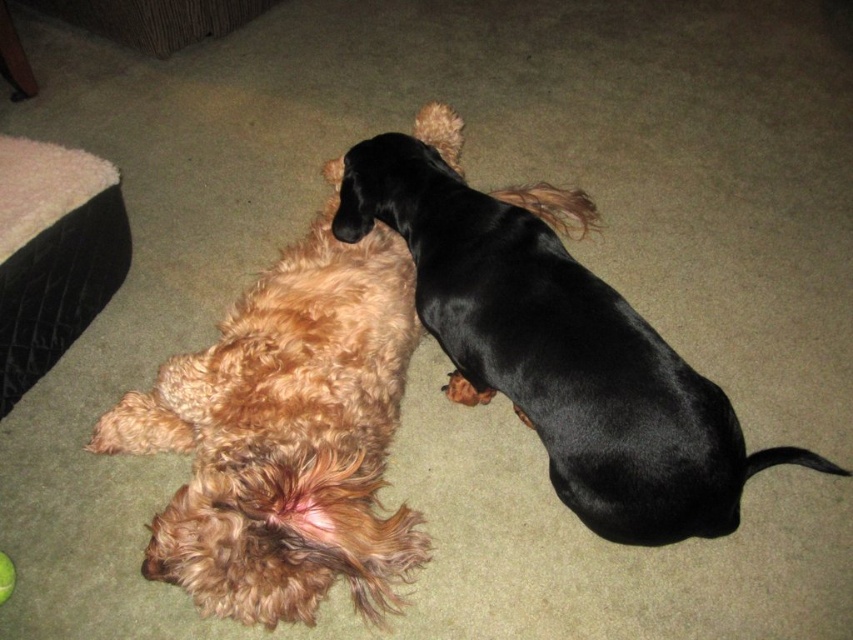
You are a dog owner who wants to place a rectangular dog bed in the middle of the room. The bed is exactly the width of the fuzzy brown dog at center. Will this bed also fit the black shiny dog at center?

The fuzzy brown dog at center has a lesser width compared to black shiny dog at center, so the bed designed to fit the fuzzy brown dog at center will not be wide enough for the black shiny dog at center.

You are trying to decide whether to place a new rectangular dog bed in the living room. The fuzzy brown dog at center and the black quilted dog bed at left are already there. Which object is wider?

The fuzzy brown dog at center might be wider than the black quilted dog bed at left, so it is possible that the fuzzy brown dog at center is wider.

You are a pet sitter who needs to place a new toy between the black shiny dog at center and the black quilted dog bed at left. Based on their positions, which side of the dog bed should you place the toy to ensure it is between them?

The black shiny dog at center is positioned on the right side of the black quilted dog bed at left, so placing the toy to the right of the black quilted dog bed at left would place it between the two.